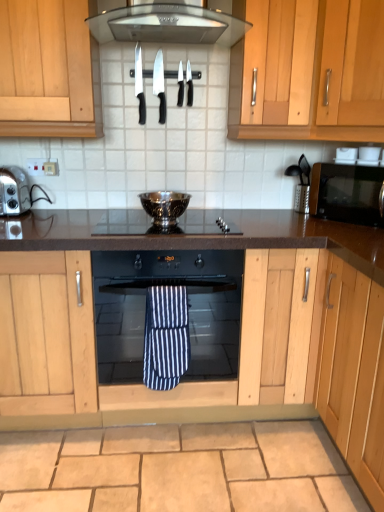
What do you see at coordinates (346, 193) in the screenshot? This screenshot has height=512, width=384. I see `black glossy microwave at right` at bounding box center [346, 193].

Measure the distance between black plastic knife at upper center, the 1th knife viewed from the left, and camera.

The depth of black plastic knife at upper center, the 1th knife viewed from the left, is 6.40 feet.

In the scene shown: Measure the distance between point (112,228) and camera.

Point (112,228) is 6.35 feet from camera.

The image size is (384, 512). What do you see at coordinates (188, 308) in the screenshot? I see `black glass oven at center` at bounding box center [188, 308].

You are a GUI agent. You are given a task and a screenshot of the screen. Output one action in this format:
    pyautogui.click(x=<x>, y=<y>)
    Task: Click on the stainless steel range hood at upper center
    
    Given the screenshot: What is the action you would take?
    coord(167,25)

Locate an element on the screen. This screenshot has width=384, height=512. silver metallic bowl at center is located at coordinates (164, 206).

Locate an element on the screen. This screenshot has width=384, height=512. black glossy microwave at right is located at coordinates (346, 193).

Where is `beach towel below the black glass oven at center (from the image's perspective)`? The width and height of the screenshot is (384, 512). beach towel below the black glass oven at center (from the image's perspective) is located at coordinates (166, 337).

From a real-world perspective, is blue striped towel at center above or below black glass oven at center?

In terms of real-world spatial position, blue striped towel at center is below black glass oven at center.

How different are the orientations of blue striped towel at center and black glass oven at center in degrees?

blue striped towel at center and black glass oven at center are facing 0.176 degrees away from each other.

From the image's perspective, is blue striped towel at center above black glass oven at center?

No, from the image's perspective, blue striped towel at center is not above black glass oven at center.

The height and width of the screenshot is (512, 384). In the image, there is a black glass oven at center. Identify the location of gas stove above it (from the image's perspective). (164, 225).

From the image's perspective, which object appears higher, black glass oven at center or polished glass gas stove at center?

polished glass gas stove at center, from the image's perspective.

From the picture: From a real-world perspective, does black glass oven at center sit lower than polished glass gas stove at center?

Yes, from a real-world perspective, black glass oven at center is below polished glass gas stove at center.

Visually, is black glass oven at center positioned to the left or to the right of polished glass gas stove at center?

In the image, black glass oven at center appears on the left side of polished glass gas stove at center.

Can you tell me how much black plastic knife at upper center, the 1th knife viewed from the left, and black plastic knife at upper center, which is the fourth knife from left to right, differ in facing direction?

The facing directions of black plastic knife at upper center, the 1th knife viewed from the left, and black plastic knife at upper center, which is the fourth knife from left to right, are 1.29 degrees apart.

Which is in front, point (140, 99) or point (190, 98)?

The point (140, 99) is closer.

Does black plastic knife at upper center, the 1th knife viewed from the left, have a larger size compared to black plastic knife at upper center, which is the fourth knife from left to right?

Indeed, black plastic knife at upper center, the 1th knife viewed from the left, has a larger size compared to black plastic knife at upper center, which is the fourth knife from left to right.

Is black plastic knife at upper center, the 1th knife viewed from the left, far away from black plastic knife at upper center, which is the fourth knife from left to right?

No, there isn't a large distance between black plastic knife at upper center, the 1th knife viewed from the left, and black plastic knife at upper center, which is the fourth knife from left to right.

Is silver metallic toaster at left shorter than beige stone granite at lower center?

No, silver metallic toaster at left is not shorter than beige stone granite at lower center.

From a real-world perspective, relative to beige stone granite at lower center, is silver metallic toaster at left vertically above or below?

From a real-world perspective, silver metallic toaster at left is physically above beige stone granite at lower center.

From the image's perspective, which is below, silver metallic toaster at left or beige stone granite at lower center?

beige stone granite at lower center appears lower in the image.

Does silver metallic toaster at left touch beige stone granite at lower center?

They are not placed beside each other.

Which is farther from the camera, [144,100] or [171,322]?

Positioned behind is point [144,100].

Considering the relative sizes of black plastic knife at upper center, the 1th knife viewed from the left, and blue striped towel at center in the image provided, is black plastic knife at upper center, the 1th knife viewed from the left, wider than blue striped towel at center?

No.

Is black plastic knife at upper center, the 1th knife viewed from the left, further to camera compared to blue striped towel at center?

Yes, black plastic knife at upper center, the 1th knife viewed from the left, is behind blue striped towel at center.

From the image's perspective, is black plastic knife at upper center, the fourth knife viewed from the right, positioned above or below blue striped towel at center?

Clearly, from the image's perspective, black plastic knife at upper center, the fourth knife viewed from the right, is above blue striped towel at center.

Which is in front, black plastic knife at upper center, marked as the 1th knife in a right-to-left arrangement, or black glossy microwave at right?

Positioned in front is black glossy microwave at right.

Does point (189, 99) appear closer or farther from the camera than point (359, 180)?

Point (189, 99) is positioned farther from the camera compared to point (359, 180).

Would you say black plastic knife at upper center, which is the fourth knife from left to right, is outside black glossy microwave at right?

Yes, black plastic knife at upper center, which is the fourth knife from left to right, is outside of black glossy microwave at right.

Is black plastic knife at upper center, which is the fourth knife from left to right, looking in the opposite direction of black glossy microwave at right?

black plastic knife at upper center, which is the fourth knife from left to right, does not have its back to black glossy microwave at right.

Is metallic black coffee machine at right far away from polished glass gas stove at center?

No, metallic black coffee machine at right is not far from polished glass gas stove at center.

Which is closer to the camera, (306, 165) or (219, 225)?

Point (306, 165) is closer to the camera than point (219, 225).

Does metallic black coffee machine at right appear on the right side of polished glass gas stove at center?

Correct, you'll find metallic black coffee machine at right to the right of polished glass gas stove at center.

Is metallic black coffee machine at right looking in the opposite direction of polished glass gas stove at center?

That's not correct — metallic black coffee machine at right is not looking away from polished glass gas stove at center.

Where is `oven above the blue striped towel at center (from the image's perspective)`? This screenshot has width=384, height=512. oven above the blue striped towel at center (from the image's perspective) is located at coordinates (188, 308).

At what (x,y) coordinates should I click in order to perform the action: click on gas stove behind the black glass oven at center. Please return your answer as a coordinate pair (x, y). Image resolution: width=384 pixels, height=512 pixels. Looking at the image, I should click on (164, 225).

From the image, which object appears to be farther from black glass oven at center, light wood cabinet at upper right or polished stainless steel knife at center, the 2th knife in the right-to-left sequence?

Based on the image, polished stainless steel knife at center, the 2th knife in the right-to-left sequence, appears to be further to black glass oven at center.

Based on their spatial positions, is metallic black coffee machine at right or black plastic knife at upper center, marked as the 1th knife in a right-to-left arrangement, closer to black plastic knife at upper center, which appears as the second knife when viewed from the left?

black plastic knife at upper center, marked as the 1th knife in a right-to-left arrangement, is positioned closer to the anchor black plastic knife at upper center, which appears as the second knife when viewed from the left.

Based on their spatial positions, is light wood cabinet at upper right or beige stone granite at lower center closer to black glossy microwave at right?

Based on the image, light wood cabinet at upper right appears to be nearer to black glossy microwave at right.

From the image, which object appears to be farther from blue striped towel at center, polished glass gas stove at center or black glass oven at center?

Based on the image, polished glass gas stove at center appears to be further to blue striped towel at center.

Based on their spatial positions, is black plastic knife at upper center, marked as the 3th knife in a right-to-left arrangement, or black plastic knife at upper center, which is the fourth knife from left to right, further from black glossy microwave at right?

black plastic knife at upper center, marked as the 3th knife in a right-to-left arrangement, is positioned further to the anchor black glossy microwave at right.

Which object lies nearer to the anchor point silver metallic bowl at center, black glass oven at center or stainless steel range hood at upper center?

The object closer to silver metallic bowl at center is black glass oven at center.

Based on their spatial positions, is black plastic knife at upper center, marked as the 1th knife in a right-to-left arrangement, or black plastic knife at upper center, the 1th knife viewed from the left, further from blue striped towel at center?

black plastic knife at upper center, marked as the 1th knife in a right-to-left arrangement, is further to blue striped towel at center.

Considering their positions, is metallic black coffee machine at right positioned closer to blue striped towel at center than black plastic knife at upper center, marked as the 1th knife in a right-to-left arrangement?

metallic black coffee machine at right is positioned closer to the anchor blue striped towel at center.

You are a GUI agent. You are given a task and a screenshot of the screen. Output one action in this format:
    pyautogui.click(x=<x>, y=<y>)
    Task: Click on the gas stove between silver metallic bowl at center and blue striped towel at center vertically
    The image size is (384, 512).
    Given the screenshot: What is the action you would take?
    pyautogui.click(x=164, y=225)

Where is `appliance between black plastic knife at upper center, the fourth knife viewed from the right, and polished glass gas stove at center from top to bottom`? appliance between black plastic knife at upper center, the fourth knife viewed from the right, and polished glass gas stove at center from top to bottom is located at coordinates (164, 206).

I want to click on home appliance between silver metallic toaster at left and black plastic knife at upper center, which is the fourth knife from left to right, from left to right, so click(x=167, y=25).

Identify the location of appliance between polished stainless steel knife at center, the 2th knife in the right-to-left sequence, and polished glass gas stove at center from top to bottom. The width and height of the screenshot is (384, 512). (164, 206).